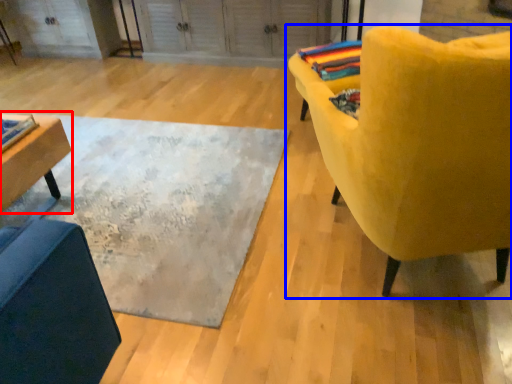
Question: Among these objects, which one is farthest to the camera, table (highlighted by a red box) or chair (highlighted by a blue box)?

Choices:
 (A) table
 (B) chair

Answer: (A)